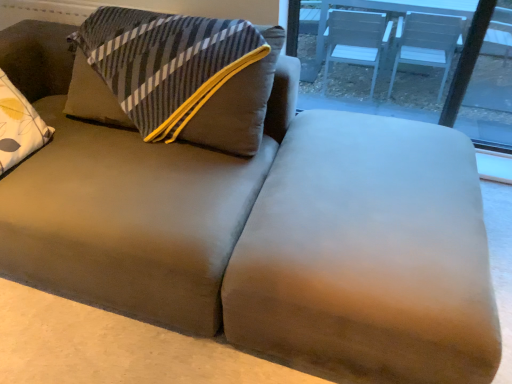
Question: Is transparent glass table at upper right taller or shorter than suede-like brown ottoman at center?

Choices:
 (A) short
 (B) tall

Answer: (B)

Question: Visually, is transparent glass table at upper right positioned to the left or to the right of suede-like brown ottoman at center?

Choices:
 (A) right
 (B) left

Answer: (A)

Question: Is transparent glass table at upper right inside or outside of suede-like brown ottoman at center?

Choices:
 (A) outside
 (B) inside

Answer: (A)

Question: In terms of width, does suede-like brown ottoman at center look wider or thinner when compared to transparent glass table at upper right?

Choices:
 (A) thin
 (B) wide

Answer: (B)

Question: In terms of height, does suede-like brown ottoman at center look taller or shorter compared to transparent glass table at upper right?

Choices:
 (A) tall
 (B) short

Answer: (B)

Question: Based on their positions, is suede-like brown ottoman at center located to the left or right of transparent glass table at upper right?

Choices:
 (A) right
 (B) left

Answer: (B)

Question: In terms of size, does suede-like brown ottoman at center appear bigger or smaller than transparent glass table at upper right?

Choices:
 (A) small
 (B) big

Answer: (B)